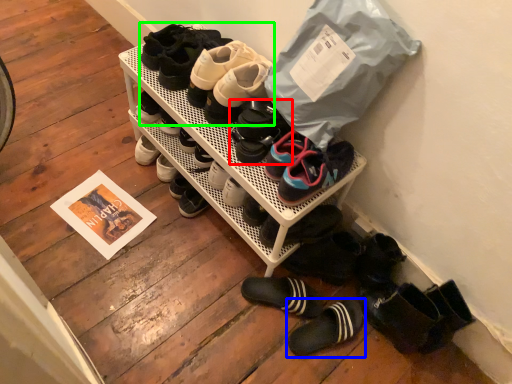
Question: Which object is positioned closest to footwear (highlighted by a red box)? Select from footwear (highlighted by a blue box) and footwear (highlighted by a green box).

Choices:
 (A) footwear
 (B) footwear

Answer: (B)